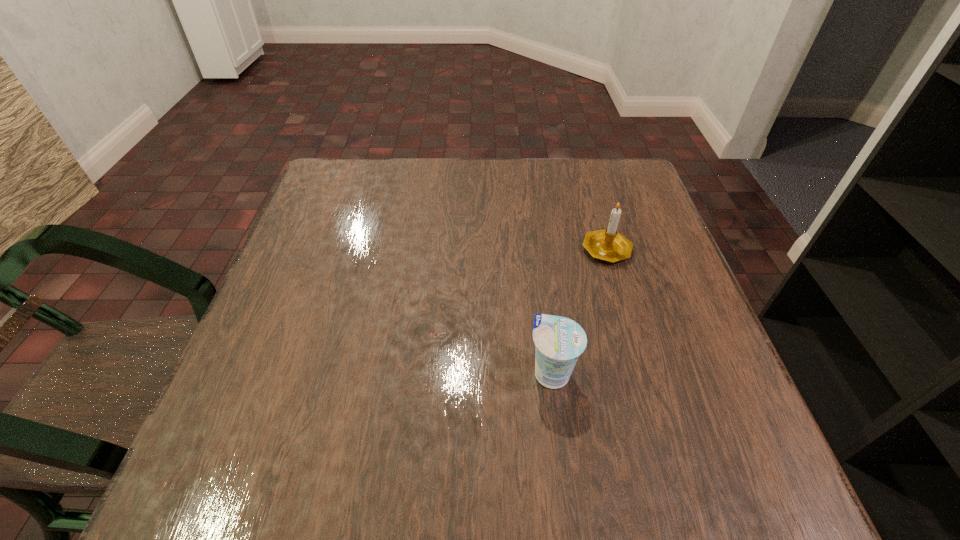
The image size is (960, 540). Find the location of `free location at the right edge`. free location at the right edge is located at coordinates (652, 367).

The width and height of the screenshot is (960, 540). Find the location of `vacant space at the far left corner`. vacant space at the far left corner is located at coordinates (321, 204).

Image resolution: width=960 pixels, height=540 pixels. Identify the location of vacant space at the far right corner of the desktop. (601, 169).

In the image, there is a desktop. Identify the location of vacant space at the near right corner. The width and height of the screenshot is (960, 540). (732, 468).

Find the location of a particular element. The width and height of the screenshot is (960, 540). vacant space that satisfies the following two spatial constraints: 1. on the back side of the farther object; 2. on the left side of the nearer object is located at coordinates (536, 248).

Locate an element on the screen. Image resolution: width=960 pixels, height=540 pixels. free point that satisfies the following two spatial constraints: 1. on the back side of the left object; 2. on the right side of the candle holder is located at coordinates (536, 248).

The height and width of the screenshot is (540, 960). In order to click on vacant point that satisfies the following two spatial constraints: 1. on the back side of the yogurt; 2. on the right side of the right object in this screenshot , I will do `click(536, 248)`.